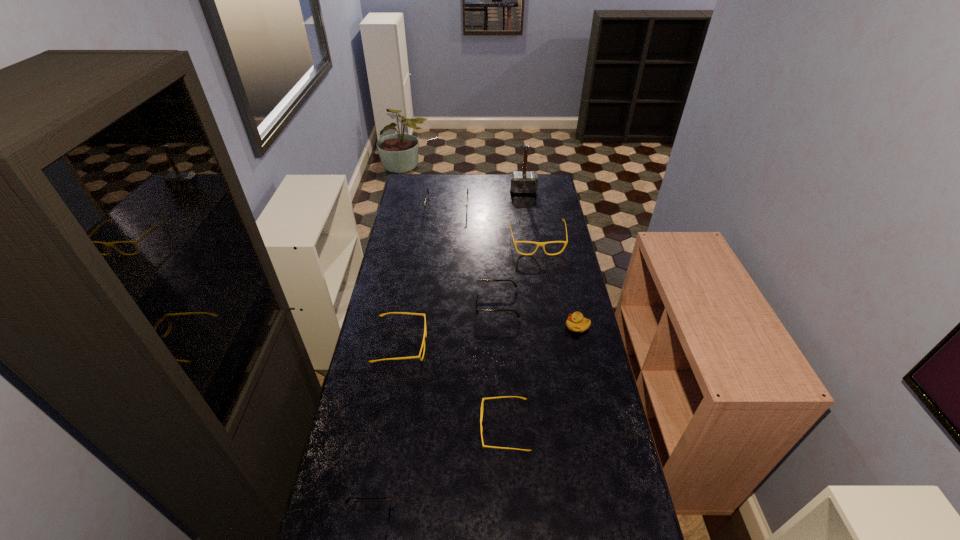
In order to click on the second farthest black spectacles in this screenshot , I will do `click(476, 294)`.

The height and width of the screenshot is (540, 960). Find the location of `the fifth farthest spectacles`. the fifth farthest spectacles is located at coordinates (483, 399).

Locate an element on the screen. This screenshot has width=960, height=540. the second nearest object is located at coordinates (483, 399).

Where is `free space located on the left of the farthest object`? The width and height of the screenshot is (960, 540). free space located on the left of the farthest object is located at coordinates (495, 191).

Identify the location of blank area located in front of the lenses of the biggest beige spectacles. (543, 278).

Where is `free space located at the hinge ends of the farthest spectacles`? The width and height of the screenshot is (960, 540). free space located at the hinge ends of the farthest spectacles is located at coordinates (443, 252).

This screenshot has height=540, width=960. Find the location of `free location located 0.100m on the front-facing side of the yellow duckling`. free location located 0.100m on the front-facing side of the yellow duckling is located at coordinates (540, 327).

Image resolution: width=960 pixels, height=540 pixels. Identify the location of vacant point located 0.150m on the front-facing side of the yellow duckling. (527, 327).

The image size is (960, 540). What are the coordinates of `free space located on the front-facing side of the yellow duckling` in the screenshot? It's located at (535, 327).

At what (x,y) coordinates should I click in order to perform the action: click on vacant space located in front of the lenses of the third nearest spectacles. Please return your answer as a coordinate pair (x, y). This screenshot has width=960, height=540. Looking at the image, I should click on 443,345.